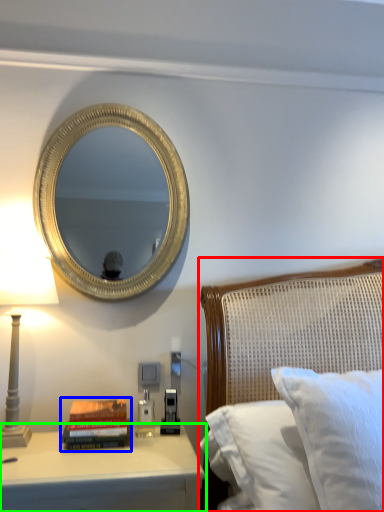
Question: Based on their relative distances, which object is nearer to bed (highlighted by a red box)? Choose from paperback book (highlighted by a blue box) and nightstand (highlighted by a green box).

Choices:
 (A) paperback book
 (B) nightstand

Answer: (B)